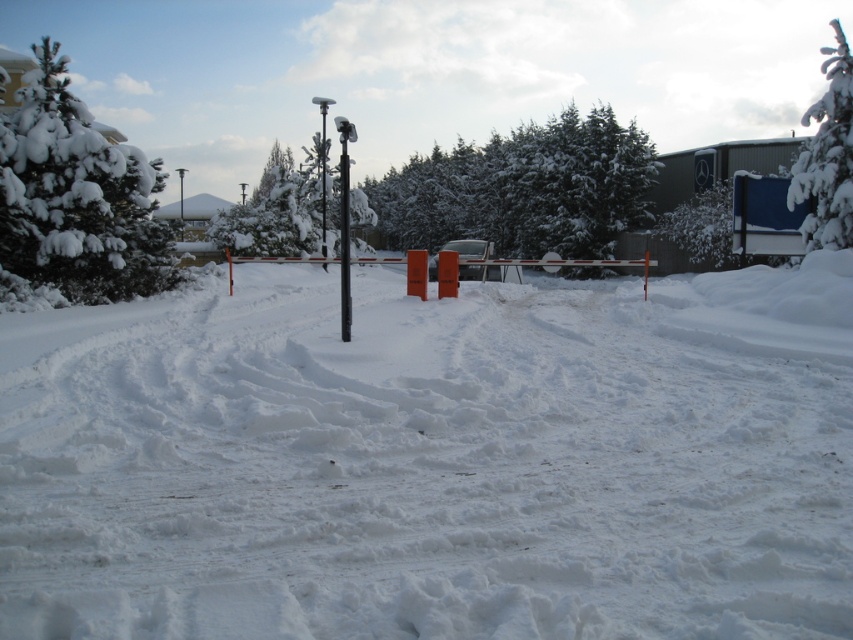
Question: Which of the following is the farthest from the observer?

Choices:
 (A) white fluffy snow at center
 (B) orange plastic barrier at center

Answer: (B)

Question: Among these points, which one is nearest to the camera?

Choices:
 (A) (468, 328)
 (B) (815, 212)

Answer: (A)

Question: Is white fluffy snow at center positioned behind metallic pole at center?

Choices:
 (A) yes
 (B) no

Answer: (B)

Question: Is orange plastic barrier at center closer to the viewer compared to metallic pole at center?

Choices:
 (A) no
 (B) yes

Answer: (A)

Question: Does white fluffy tree at upper left have a lesser width compared to orange plastic barrier at center?

Choices:
 (A) yes
 (B) no

Answer: (B)

Question: Which point is closer to the camera?

Choices:
 (A) orange plastic barrier at center
 (B) white fluffy snow at center

Answer: (B)